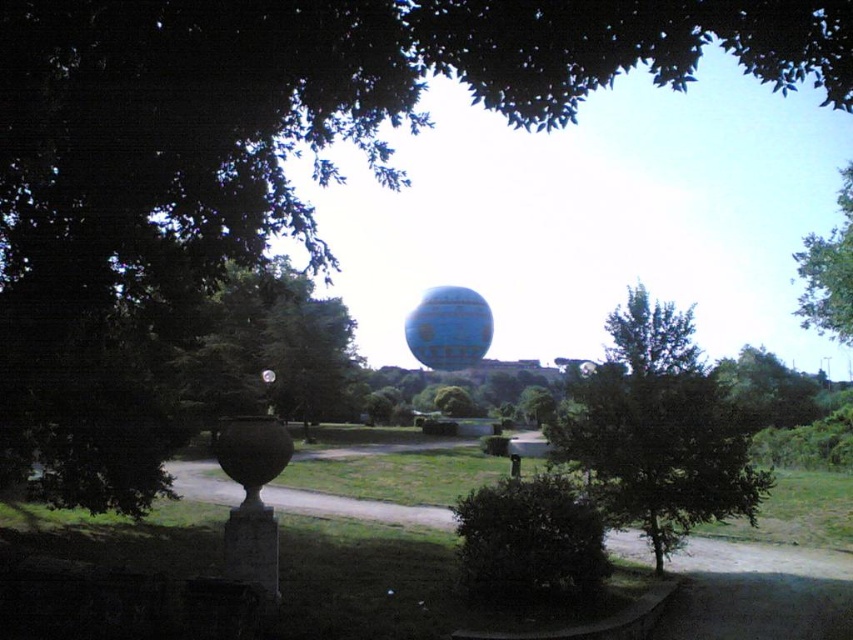
Consider the image. You are planning to take a photo of the green leafy tree at left and the blue rubber balloon at center. Which object should you focus on first if you want to capture both in a single frame without moving the camera?

The green leafy tree at left is bigger than the blue rubber balloon at center, so you should focus on the green leafy tree at left first to ensure it fits well in the frame before adjusting for the smaller balloon.

You are standing on the paved pathway in the midground and want to walk towards the green leafy tree at upper right. Which direction should you go to avoid the green leafy tree at center?

Since the green leafy tree at center is to the left of the green leafy tree at upper right, you should walk to the right to avoid the green leafy tree at center and head towards the green leafy tree at upper right.